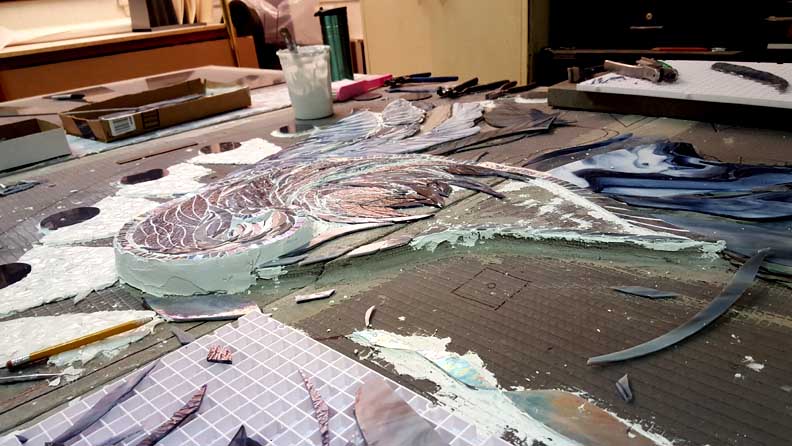
Locate an element on the screen. cabinet-looking object is located at coordinates (207, 53), (135, 72), (84, 74).